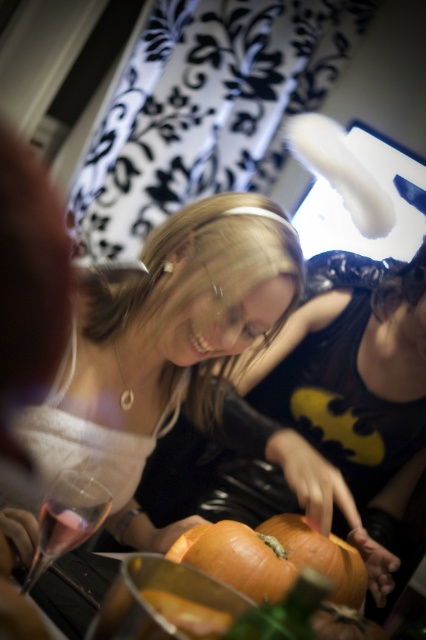
You are a photographer standing in front of the table where the two people are carving pumpkins. You want to take a photo of the orange matte pumpkin at center without the matte white hairband at center blocking it. How should you adjust your position?

The orange matte pumpkin at center is behind the matte white hairband at center. To avoid the hairband blocking the pumpkin, move your camera position so that the pumpkin is no longer obscured by the hairband. This could involve moving to the side or adjusting the angle to capture the pumpkin without the hairband in front of it.

You are a guest at the Halloween party and want to place a small candle on the table. The candle requires a flat surface that is at least 10 cm in height to avoid tipping over. Can the orange matte pumpkin at center or the matte white hairband at center provide a stable base for the candle?

The matte white hairband at center has a greater height compared to the orange matte pumpkin at center. Since the candle requires a flat surface at least 10 cm in height, the matte white hairband at center would be the better option as it is taller than the pumpkin.